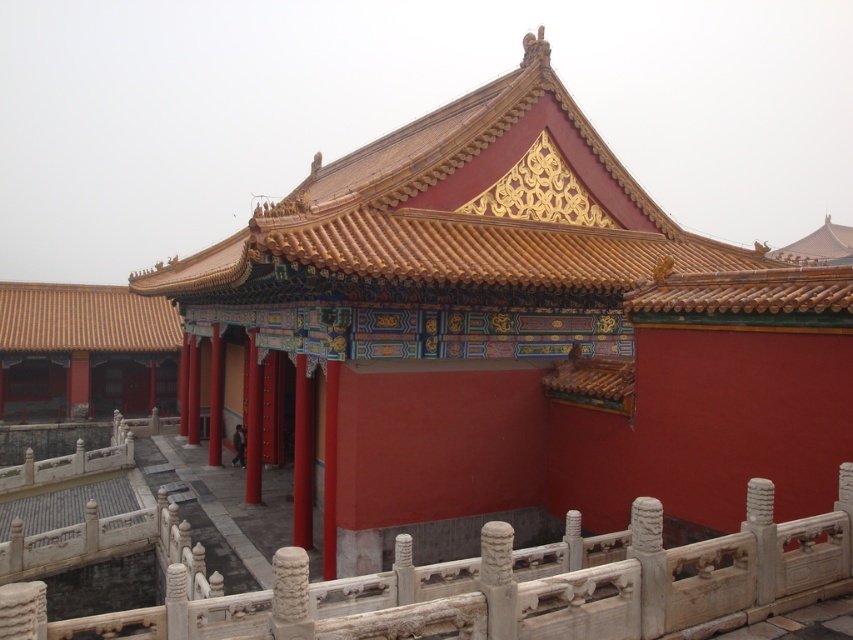
Question: Which point is farther from the camera taking this photo?

Choices:
 (A) (595, 196)
 (B) (128, 332)
 (C) (3, 609)

Answer: (B)

Question: Among these points, which one is nearest to the camera?

Choices:
 (A) (479, 572)
 (B) (151, 305)

Answer: (A)

Question: Observing the image, what is the correct spatial positioning of golden glazed tiles at upper center in reference to brown tile roof at upper left?

Choices:
 (A) left
 (B) right

Answer: (B)

Question: Which object is closer to the camera taking this photo?

Choices:
 (A) golden glazed tiles at upper center
 (B) brown tile roof at upper left

Answer: (A)

Question: Is golden glazed tiles at upper center bigger than white stone railing at lower center?

Choices:
 (A) no
 (B) yes

Answer: (B)

Question: From the image, what is the correct spatial relationship of golden glazed tiles at upper center in relation to white stone railing at lower center?

Choices:
 (A) right
 (B) left

Answer: (A)